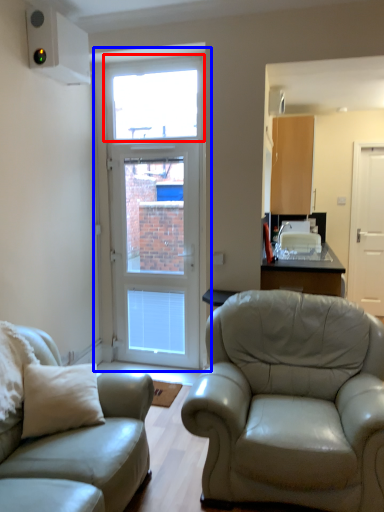
Question: Which object is closer to the camera taking this photo, window (highlighted by a red box) or door (highlighted by a blue box)?

Choices:
 (A) window
 (B) door

Answer: (B)